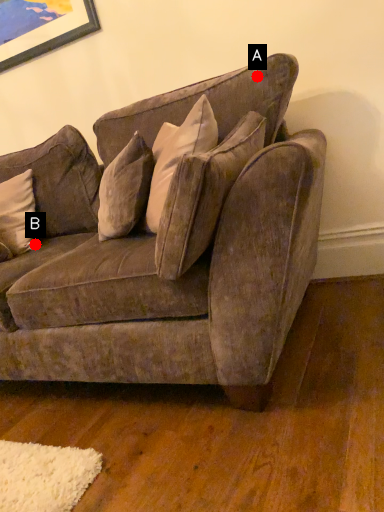
Question: Two points are circled on the image, labeled by A and B beside each circle. Which point is farther to the camera?

Choices:
 (A) A is further
 (B) B is further

Answer: (B)